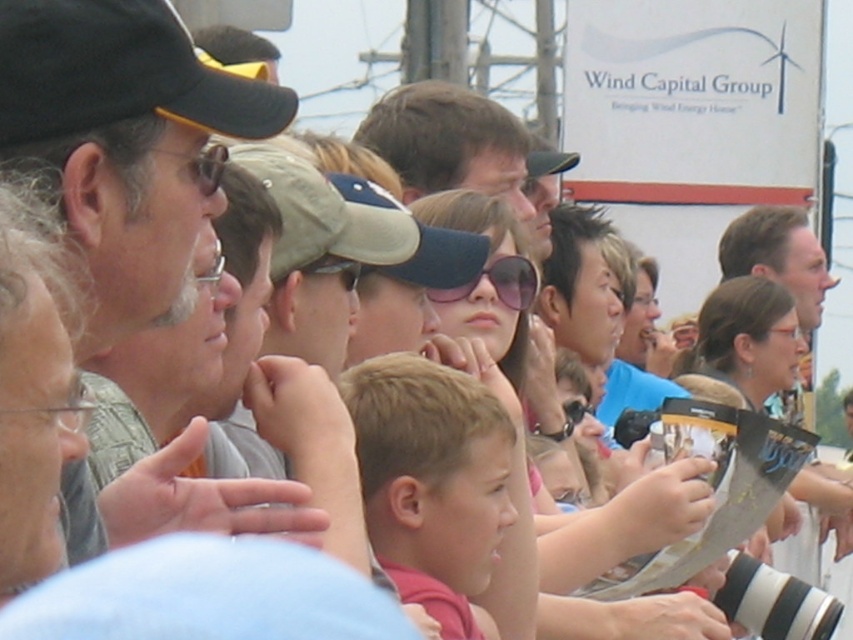
You are a delivery person who needs to navigate through the crowd to deliver a package. The package must be placed precisely between the matte black cap at left and the clear plastic glasses at center. Given that you have a 3.5 feet wide cart, can you safely maneuver your cart through the crowd to place the package without hitting either object?

The distance between the matte black cap at left and clear plastic glasses at center is 18.07 feet. Since your cart is only 3.5 feet wide, there is sufficient space to maneuver safely between them without hitting either object.

You are a photographer trying to capture a clear photo of the clear plastic glasses at center in the crowd. However, the pink reflective sunglasses at center is blocking your view. Can you adjust your angle to take the photo without the obstruction?

The pink reflective sunglasses at center is positioned over clear plastic glasses at center, so adjusting your angle downward might allow you to capture the clear plastic glasses at center without the obstruction.

You are standing in the crowd and want to locate the pink reflective sunglasses at center. According to the coordinates provided, where would you look relative to the image frame?

You should look at the coordinates point at 0.444 on the x axis and 0.585 on the y axis to locate the pink reflective sunglasses at center.